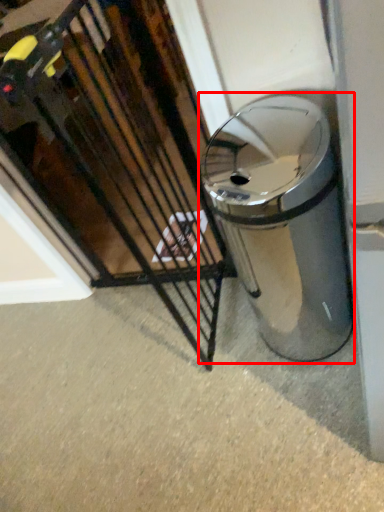
Question: From the image's perspective, what is the correct spatial relationship of waste container (annotated by the red box) in relation to cage?

Choices:
 (A) above
 (B) below

Answer: (B)